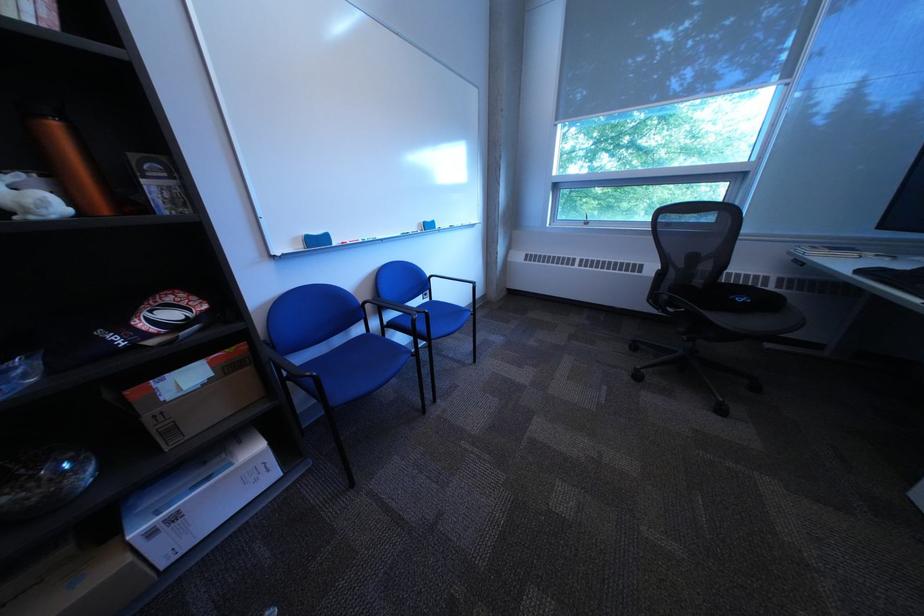
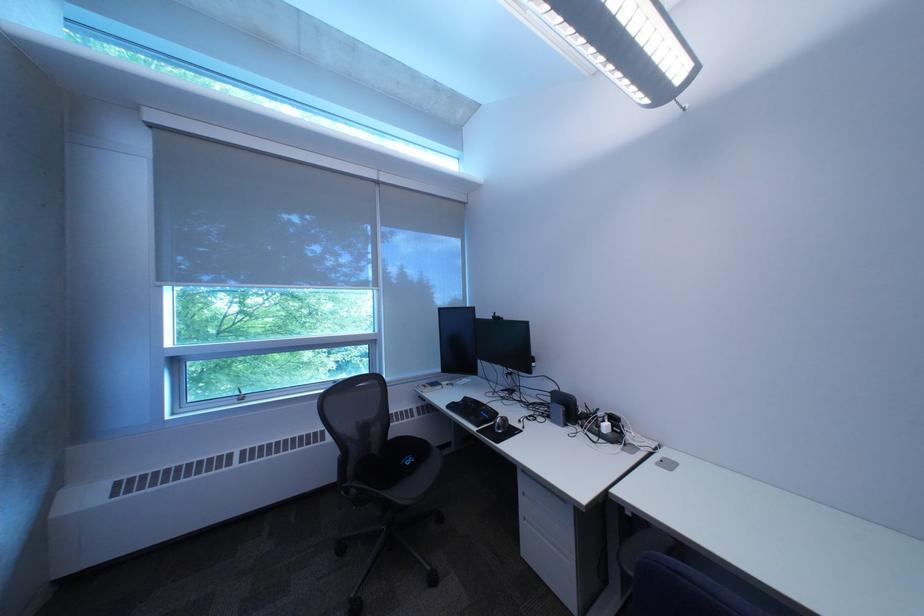
In the second image, find the point that corresponds to (x=758, y=300) in the first image.

(423, 461)